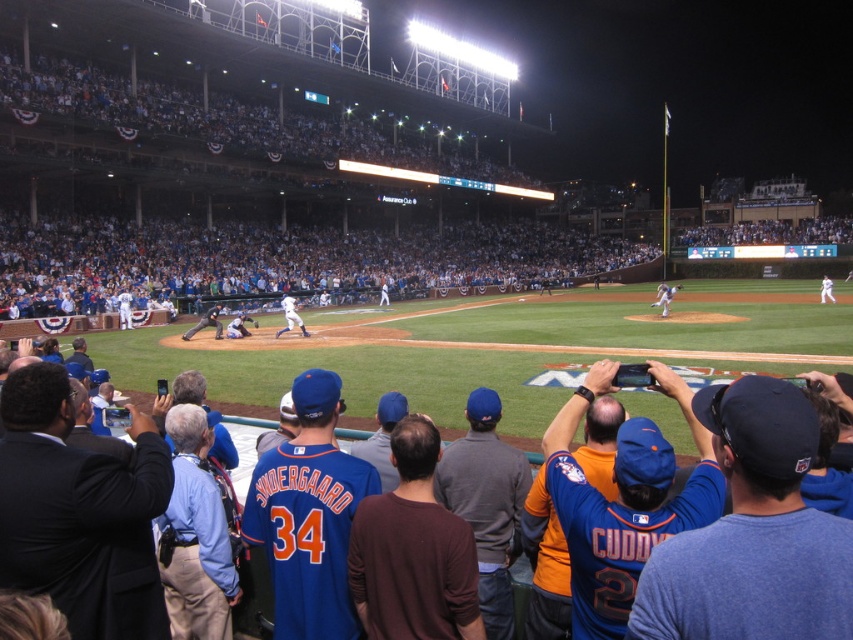
Question: Can you confirm if white uniform pitcher at center is positioned to the right of blue jersey at center?

Choices:
 (A) yes
 (B) no

Answer: (A)

Question: Which of the following is the farthest from the observer?

Choices:
 (A) (666, 307)
 (B) (143, 365)

Answer: (A)

Question: Is white uniform pitcher at center wider than blue jersey at center?

Choices:
 (A) yes
 (B) no

Answer: (A)

Question: Is white uniform pitcher at center below blue jersey at center?

Choices:
 (A) no
 (B) yes

Answer: (A)